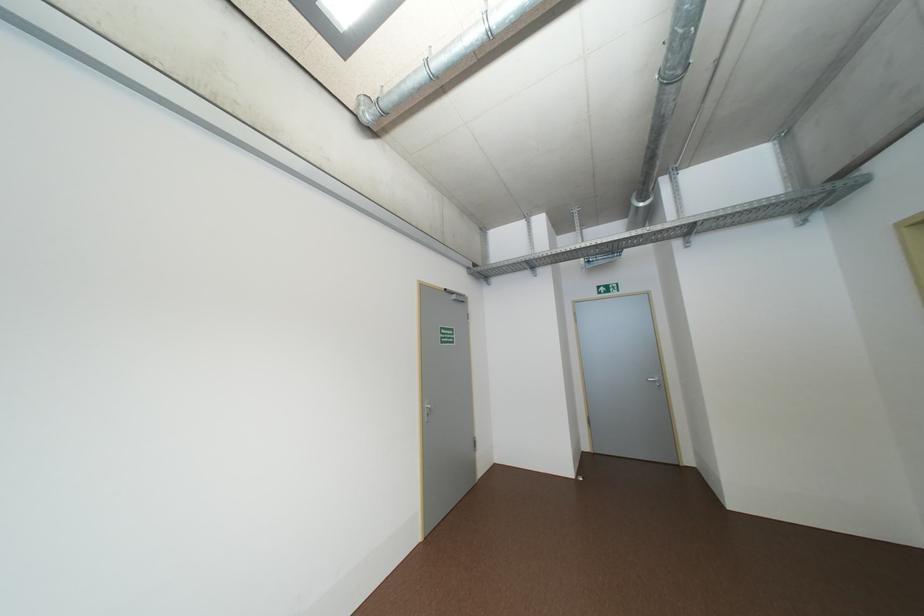
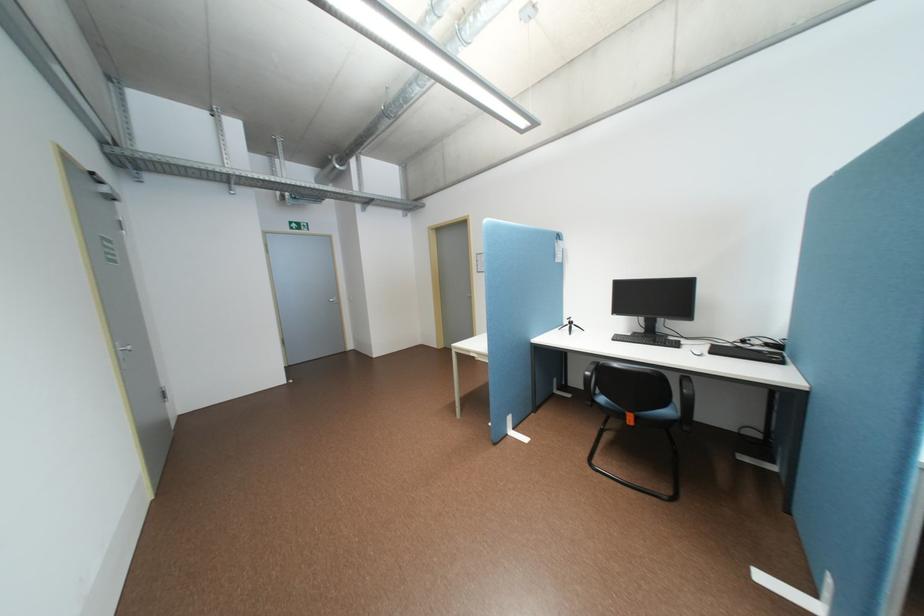
Find the pixel in the second image that matches [699,230] in the first image.

(379, 201)